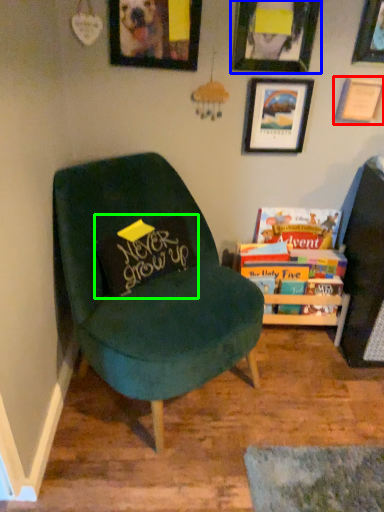
Question: Considering the real-world distances, which object is farthest from picture frame (highlighted by a red box)? picture frame (highlighted by a blue box) or pillow (highlighted by a green box)?

Choices:
 (A) picture frame
 (B) pillow

Answer: (B)